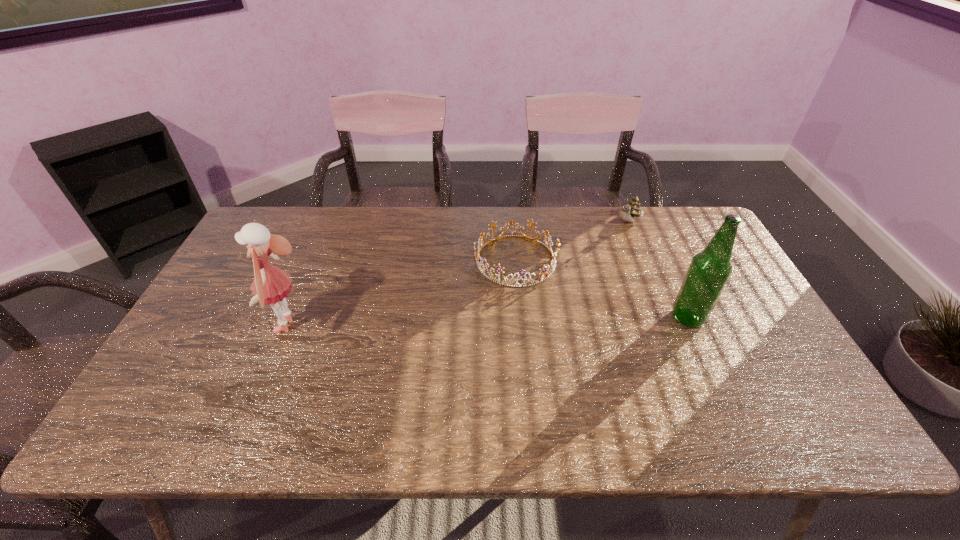
Where is `object present at the right edge`? This screenshot has height=540, width=960. object present at the right edge is located at coordinates (710, 269).

The height and width of the screenshot is (540, 960). In the image, there is a desktop. Find the location of `vacant space at the far edge`. vacant space at the far edge is located at coordinates (579, 226).

At what (x,y) coordinates should I click in order to perform the action: click on free space at the near edge of the desktop. Please return your answer as a coordinate pair (x, y). Looking at the image, I should click on 397,399.

The width and height of the screenshot is (960, 540). What are the coordinates of `vacant space at the left edge` in the screenshot? It's located at point(228,291).

Find the location of a particular element. vacant space at the right edge of the desktop is located at coordinates (734, 336).

The image size is (960, 540). In the image, there is a desktop. Find the location of `vacant space at the near left corner`. vacant space at the near left corner is located at coordinates (196, 393).

Image resolution: width=960 pixels, height=540 pixels. Find the location of `free space at the far right corner`. free space at the far right corner is located at coordinates (663, 226).

Identify the location of free region at the near right corner. (758, 390).

At what (x,y) coordinates should I click in order to perform the action: click on empty location between the beer bottle and the leftmost object. Please return your answer as a coordinate pair (x, y). This screenshot has width=960, height=540. Looking at the image, I should click on (489, 322).

Where is `free spot between the third tallest object and the shortest object`? The height and width of the screenshot is (540, 960). free spot between the third tallest object and the shortest object is located at coordinates (572, 241).